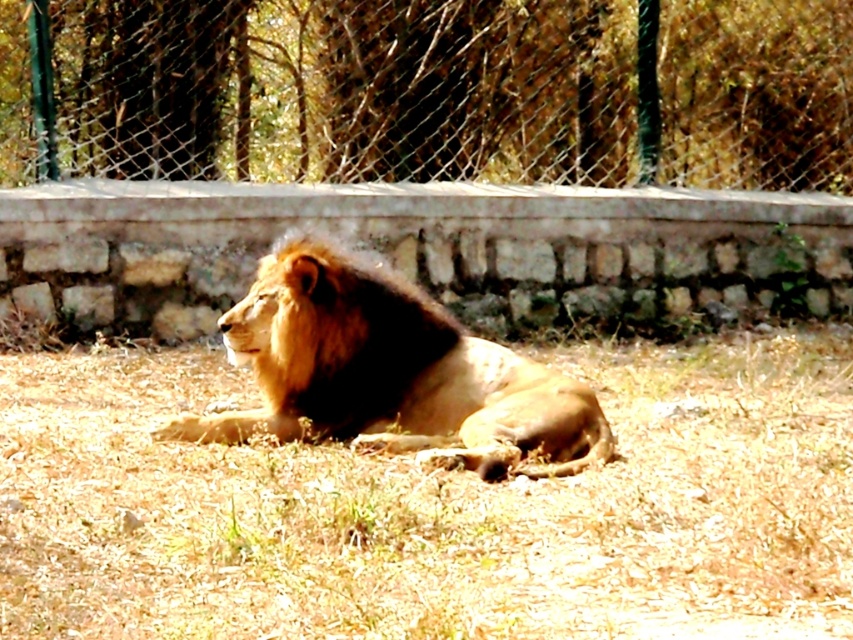
You are standing in the image and want to place a small flag at the point with coordinates point (x=433, y=508). Based on the scene description, what type of terrain will the flag be placed on?

The point (x=433, y=508) corresponds to brown dry grass at center, so the flag will be placed on dry grass terrain.

You are standing at the point marked as point (433, 508) in the image. Looking around, you see brown dry grass at center. What is directly under your feet?

The point (433, 508) is where the brown dry grass at center is located, so the ground under your feet is brown dry grass at center.

You are a small rabbit trying to cross from the left side of the wire mesh fence at center to the right side where the brown dry grass at center is located. Can you pass through the fence to reach the grass?

The brown dry grass at center is positioned on the right side of the wire mesh fence at center, so the rabbit can pass through the wire mesh fence at center to reach the grass on the right side.